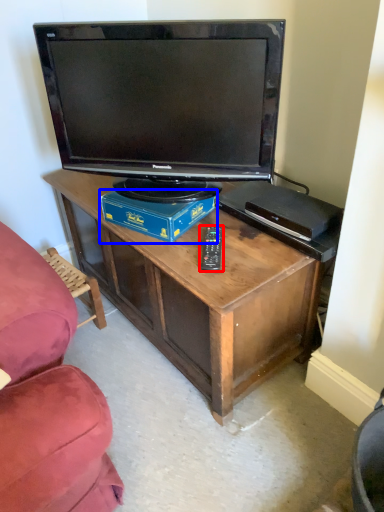
Question: Which object is further to the camera taking this photo, remote (highlighted by a red box) or box (highlighted by a blue box)?

Choices:
 (A) remote
 (B) box

Answer: (B)